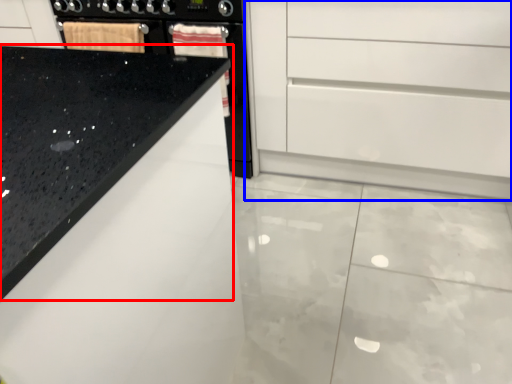
Question: Which object is closer to the camera taking this photo, countertop (highlighted by a red box) or chest of drawers (highlighted by a blue box)?

Choices:
 (A) countertop
 (B) chest of drawers

Answer: (A)